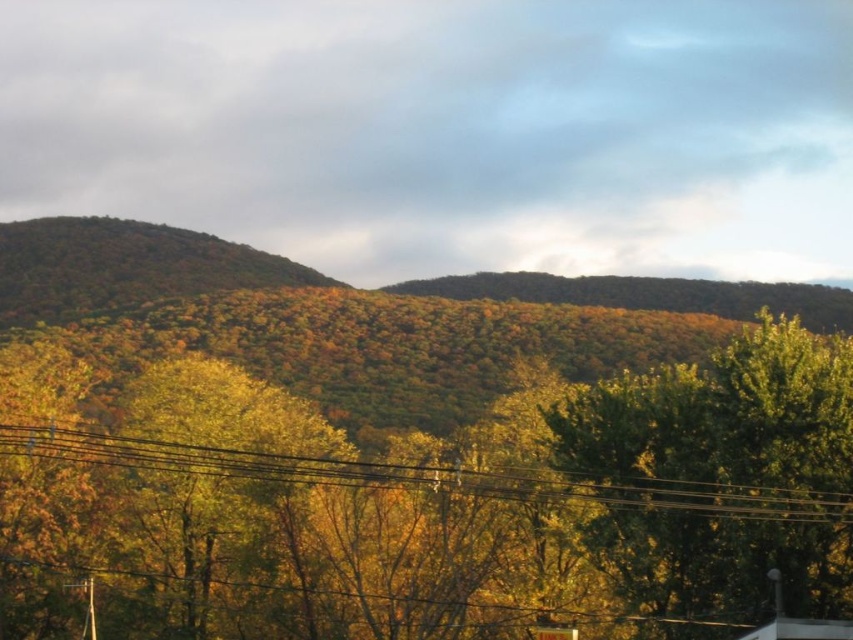
Question: Where is yellow-green foliage at center located in relation to metallic wires at lower center in the image?

Choices:
 (A) left
 (B) right

Answer: (B)

Question: Can you confirm if yellow-green foliage at center is thinner than metallic wires at lower center?

Choices:
 (A) no
 (B) yes

Answer: (A)

Question: Is yellow-green foliage at center to the left of metallic wires at lower center from the viewer's perspective?

Choices:
 (A) yes
 (B) no

Answer: (B)

Question: Among these objects, which one is nearest to the camera?

Choices:
 (A) yellow-green foliage at center
 (B) metallic wires at lower center

Answer: (A)